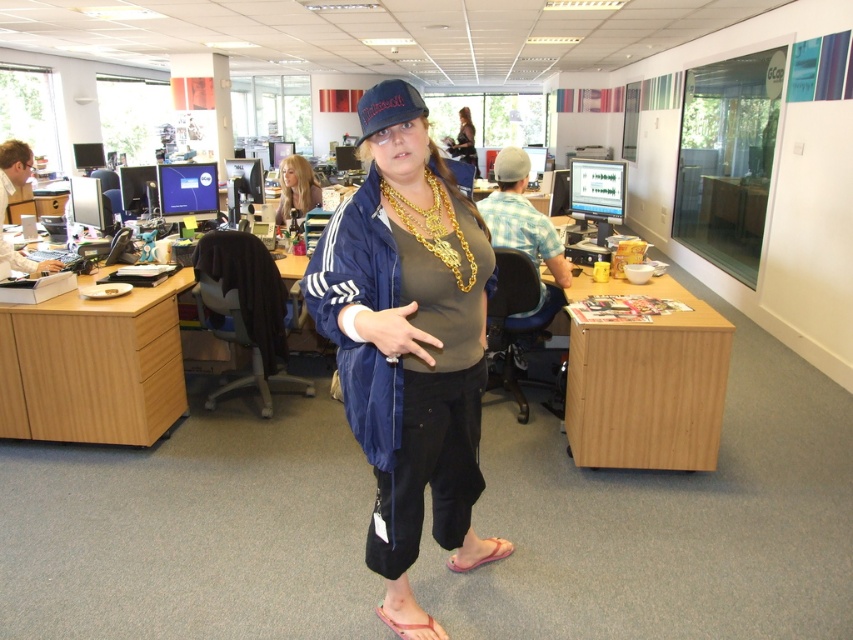
Question: In this image, where is matte black dress at center located relative to pink rubber sandal at lower center?

Choices:
 (A) right
 (B) left

Answer: (A)

Question: Which point is closer to the camera?

Choices:
 (A) matte blue jacket at center
 (B) pink rubber sandal at lower center
 (C) blonde hair at upper center
 (D) blue fabric baseball cap at center

Answer: (A)

Question: In this image, where is matte blue jacket at center located relative to pink rubber sandal at lower center?

Choices:
 (A) below
 (B) above

Answer: (B)

Question: Estimate the real-world distances between objects in this image. Which object is closer to the matte blue jacket at center?

Choices:
 (A) blue fabric baseball cap at center
 (B) blonde hair at upper center

Answer: (A)

Question: Is blue fabric baseball cap at center bigger than pink fabric sandal at lower center?

Choices:
 (A) no
 (B) yes

Answer: (B)

Question: Which point is farther to the camera?

Choices:
 (A) click(450, 556)
 (B) click(422, 628)
 (C) click(386, 323)
 (D) click(506, 168)

Answer: (D)